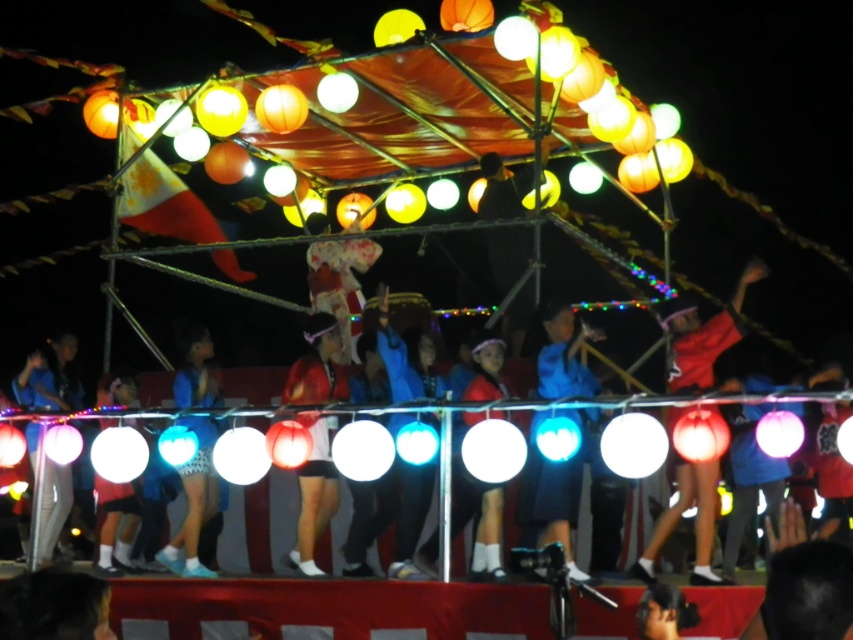
You are a photographer at the event and want to capture both the red fabric dancer at center and the blue fabric at center in a single frame. Which one should you focus on first to ensure both are in the frame?

The red fabric dancer at center has a smaller size compared to blue fabric at center. To ensure both are in the frame, focus on the larger blue fabric at center first, then adjust to include the smaller red fabric dancer at center.